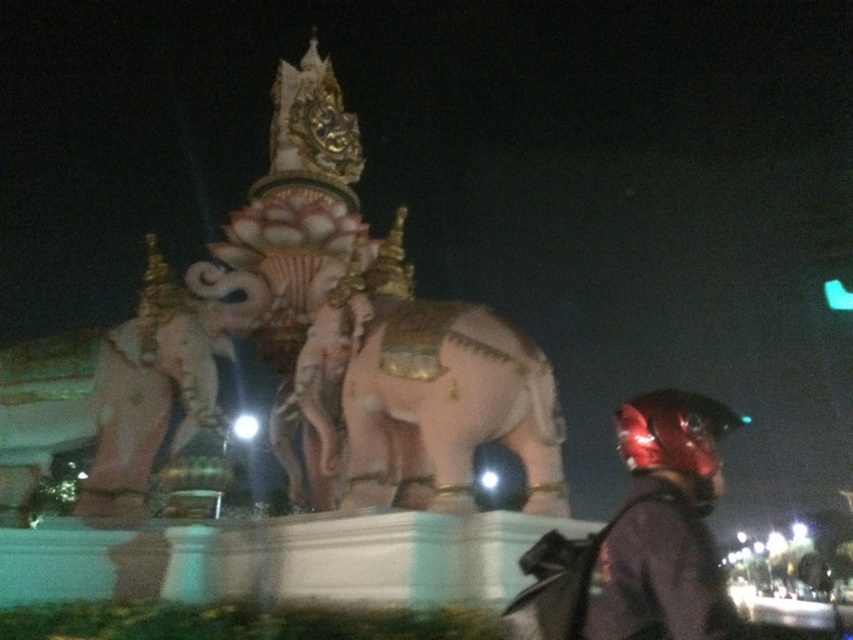
You are a photographer standing in front of the monument. You want to take a photo that includes both the smooth pinkish elephant at center and the shiny red helmet at lower right. Which object should you focus on first to ensure both are in frame?

You should focus on the smooth pinkish elephant at center first because it is taller than the shiny red helmet at lower right, so adjusting the frame to include its height will naturally accommodate the smaller helmet in the shot.

In the scene shown: You are a photographer trying to capture the monument with both the smooth pinkish elephant at center and the shiny red helmet at lower right in the frame. Considering their sizes, which object should you zoom in on to ensure both are clearly visible?

The smooth pinkish elephant at center has a lesser width compared to shiny red helmet at lower right. To ensure both are clearly visible, you should zoom in on the shiny red helmet at lower right since it is larger and will remain in focus while accommodating the smaller elephant in the frame.

Based on the scene description, which object takes up more area in the image? Please choose between the smooth pinkish elephant at center and the shiny red helmet at lower right.

The shiny red helmet at lower right occupies more space than the smooth pinkish elephant at center according to the description.